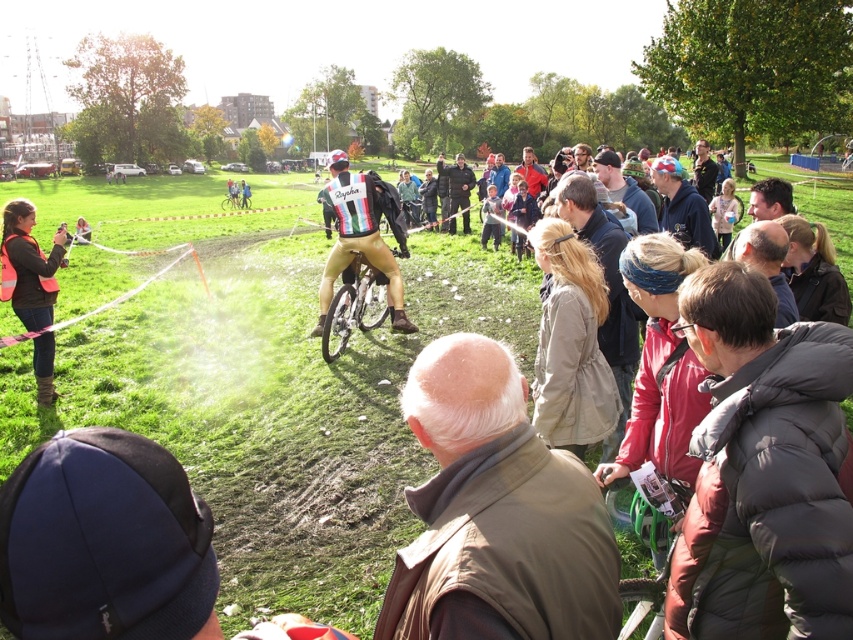
Question: Is shiny gold cycling suit at center below green matte bicycle at center?

Choices:
 (A) yes
 (B) no

Answer: (B)

Question: Is brown suede vest at center above shiny gold cycling suit at center?

Choices:
 (A) no
 (B) yes

Answer: (A)

Question: Which point is farther to the camera?

Choices:
 (A) green matte bicycle at center
 (B) reflective orange vest at left
 (C) shiny gold cycling suit at center
 (D) brown suede vest at center

Answer: (C)

Question: Which point is closer to the camera?

Choices:
 (A) (572, 584)
 (B) (22, 205)
 (C) (334, 275)
 (D) (665, 516)

Answer: (A)

Question: Based on their relative distances, which object is farther from the reflective orange vest at left?

Choices:
 (A) brown suede vest at center
 (B) green matte bicycle at center

Answer: (A)

Question: Is brown suede vest at center thinner than reflective orange vest at left?

Choices:
 (A) yes
 (B) no

Answer: (A)